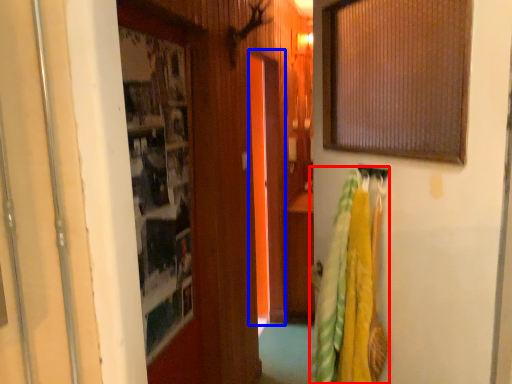
Question: Which point is closer to the camera, laundry (highlighted by a red box) or screen door (highlighted by a blue box)?

Choices:
 (A) laundry
 (B) screen door

Answer: (A)